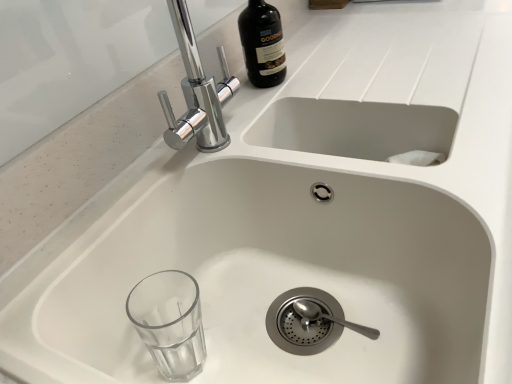
Where is `free location in front of dark brown glass bottle at upper center`? This screenshot has width=512, height=384. free location in front of dark brown glass bottle at upper center is located at coordinates (259, 110).